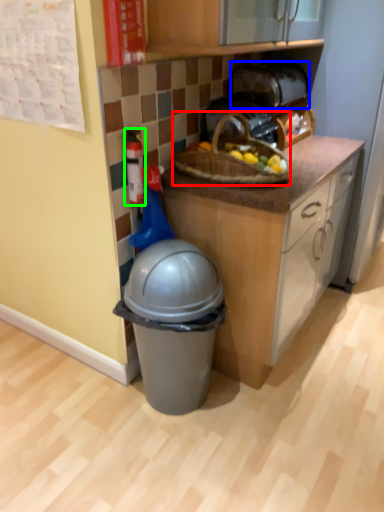
Question: Estimate the real-world distances between objects in this image. Which object is closer to picnic basket (highlighted by a red box), toaster (highlighted by a blue box) or toy (highlighted by a green box)?

Choices:
 (A) toaster
 (B) toy

Answer: (B)